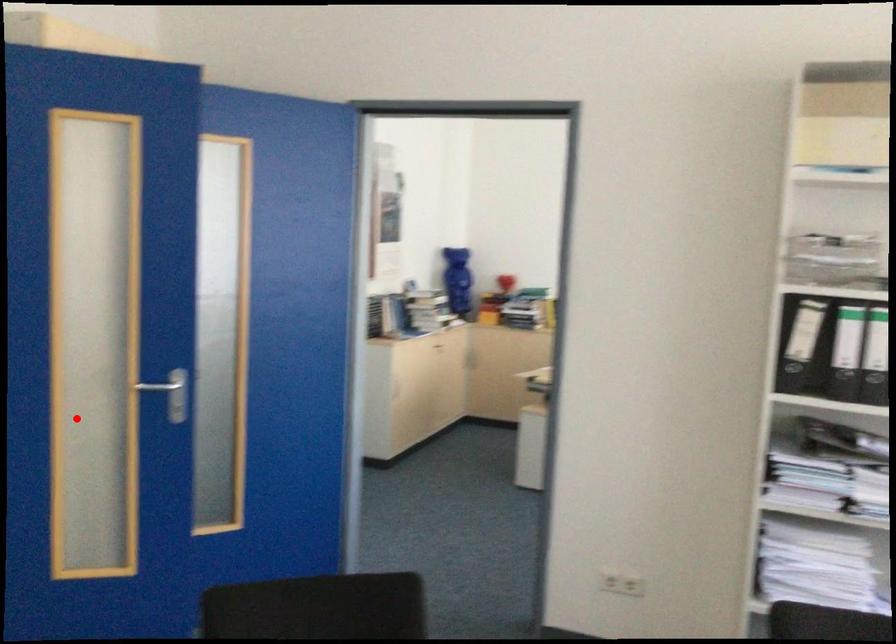
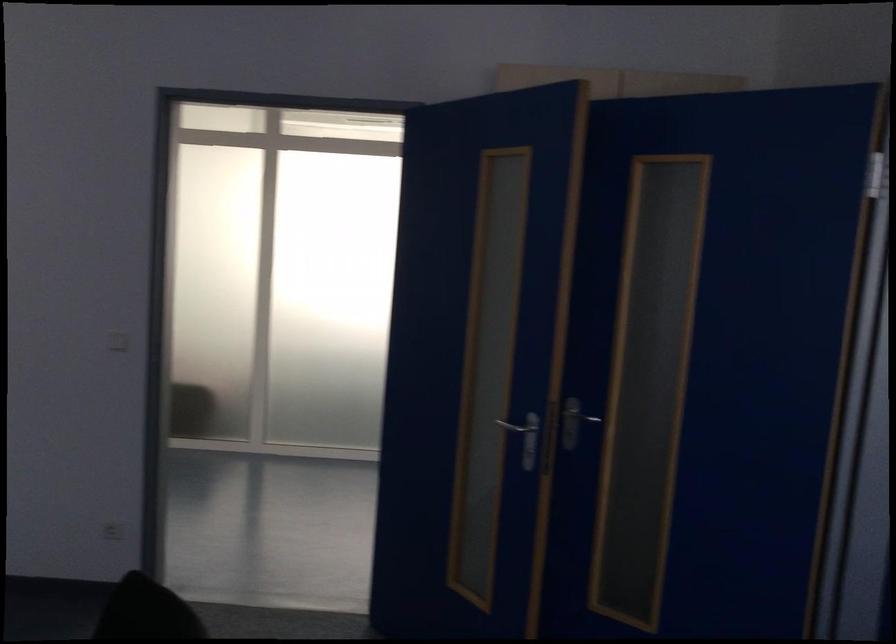
The point at the highlighted location is marked in the first image. Where is the corresponding point in the second image?

(528, 438)